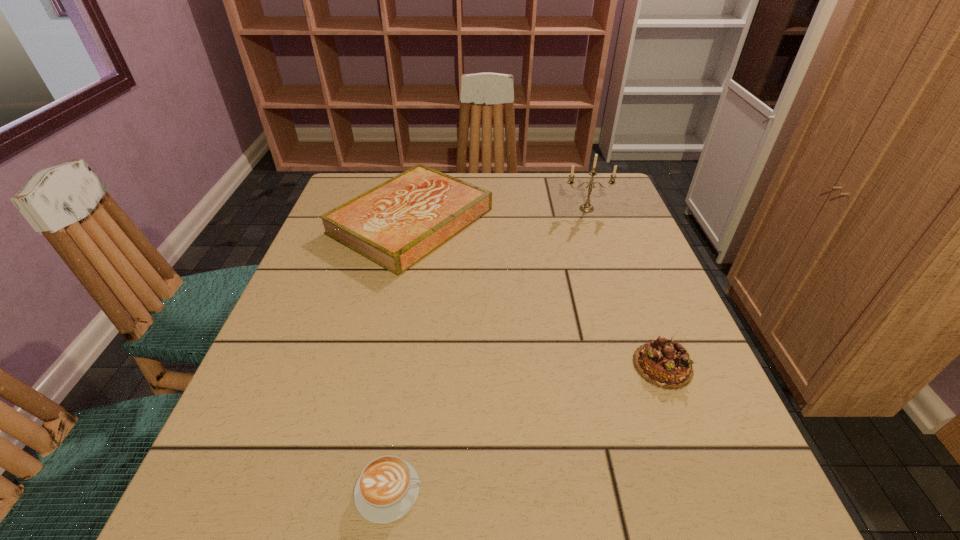
Where is `empty space between the tallest object and the hardback book`? empty space between the tallest object and the hardback book is located at coordinates (499, 215).

Where is `free area in between the candle and the shortest object`? This screenshot has height=540, width=960. free area in between the candle and the shortest object is located at coordinates (488, 349).

You are a GUI agent. You are given a task and a screenshot of the screen. Output one action in this format:
    pyautogui.click(x=<x>, y=<y>)
    Task: Click on the empty space between the chocolate cake and the candle
    Image resolution: width=960 pixels, height=540 pixels.
    Given the screenshot: What is the action you would take?
    pyautogui.click(x=625, y=287)

What are the coordinates of `blank region between the nearest object and the third farthest object` in the screenshot? It's located at (526, 428).

Locate which object ranks in proximity to the candle. Please provide its 2D coordinates. Your answer should be formatted as a tuple, i.e. [(x, y)], where the tuple contains the x and y coordinates of a point satisfying the conditions above.

[(396, 224)]

Identify which object is located as the second nearest to the nearest object. Please provide its 2D coordinates. Your answer should be formatted as a tuple, i.e. [(x, y)], where the tuple contains the x and y coordinates of a point satisfying the conditions above.

[(396, 224)]

I want to click on free spot that satisfies the following two spatial constraints: 1. on the front side of the candle; 2. on the side of the cappuccino with the handle, so (x=682, y=490).